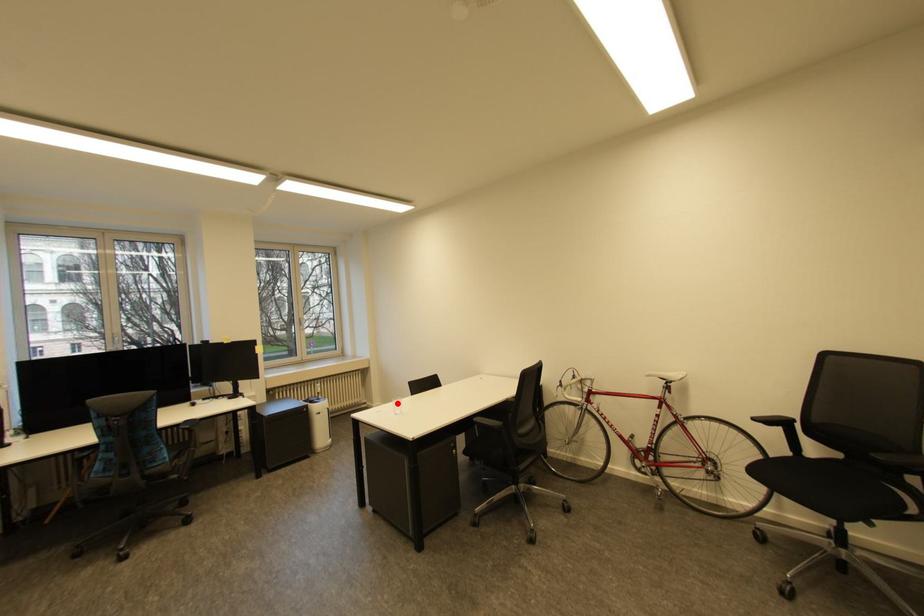
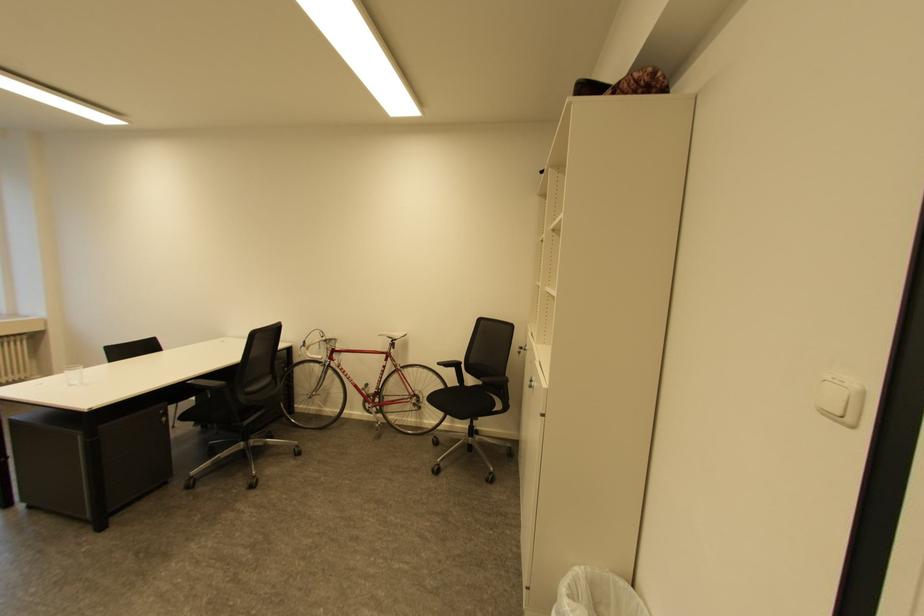
Question: I am providing you with two images of the same scene from different viewpoints. In image1, a red point is highlighted. Considering the same 3D point in image2, which of the following is correct?

Choices:
 (A) It is closer
 (B) It is farther

Answer: (A)